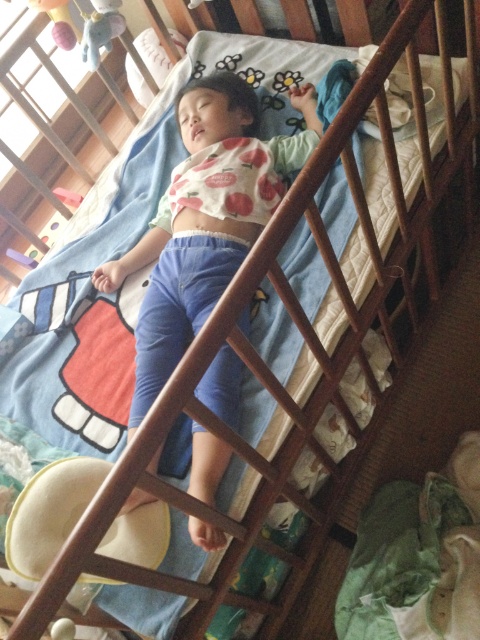
Question: Can you confirm if matte white shirt at center is smaller than soft plush elephant at upper left?

Choices:
 (A) no
 (B) yes

Answer: (A)

Question: Which of the following is the farthest from the observer?

Choices:
 (A) soft plush elephant at upper left
 (B) matte white shirt at center

Answer: (A)

Question: Is matte white shirt at center positioned before soft plush elephant at upper left?

Choices:
 (A) yes
 (B) no

Answer: (A)

Question: Which object appears farthest from the camera in this image?

Choices:
 (A) soft plush elephant at upper left
 (B) matte white shirt at center

Answer: (A)

Question: Does matte white shirt at center appear over soft plush elephant at upper left?

Choices:
 (A) yes
 (B) no

Answer: (B)